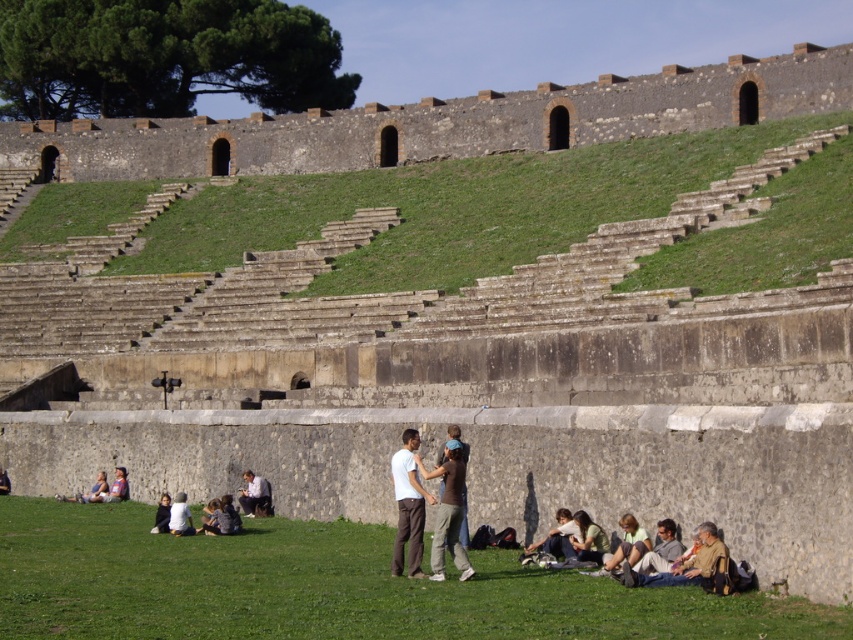
Where is `light brown fabric child at lower left`? The height and width of the screenshot is (640, 853). light brown fabric child at lower left is located at coordinates (119, 486).

Is point (128, 493) positioned in front of point (157, 522)?

No.

Who is more distant from viewer, (119, 474) or (163, 522)?

Point (119, 474)

Identify the location of light brown fabric child at lower left. (119, 486).

Looking at this image, does brown cotton shirt at center appear on the left side of dark blue fabric at lower left?

No, brown cotton shirt at center is not to the left of dark blue fabric at lower left.

Which of these two, brown cotton shirt at center or dark blue fabric at lower left, stands shorter?

dark blue fabric at lower left

The image size is (853, 640). What do you see at coordinates (448, 512) in the screenshot?
I see `brown cotton shirt at center` at bounding box center [448, 512].

You are a GUI agent. You are given a task and a screenshot of the screen. Output one action in this format:
    pyautogui.click(x=<x>, y=<y>)
    Task: Click on the brown cotton shirt at center
    
    Given the screenshot: What is the action you would take?
    pyautogui.click(x=448, y=512)

Which is more to the right, brown cotton shirt at center or white fabric at lower left?

From the viewer's perspective, brown cotton shirt at center appears more on the right side.

Can you confirm if brown cotton shirt at center is positioned above white fabric at lower left?

Yes.

What are the coordinates of `brown cotton shirt at center` in the screenshot? It's located at (448, 512).